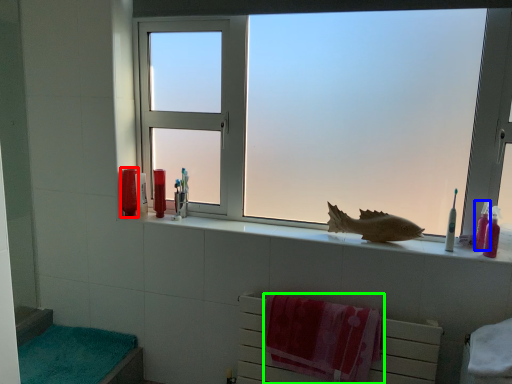
Question: Which object is the closest to the toiletry (highlighted by a red box)? Choose among these: toiletry (highlighted by a blue box) or beach towel (highlighted by a green box).

Choices:
 (A) toiletry
 (B) beach towel

Answer: (B)